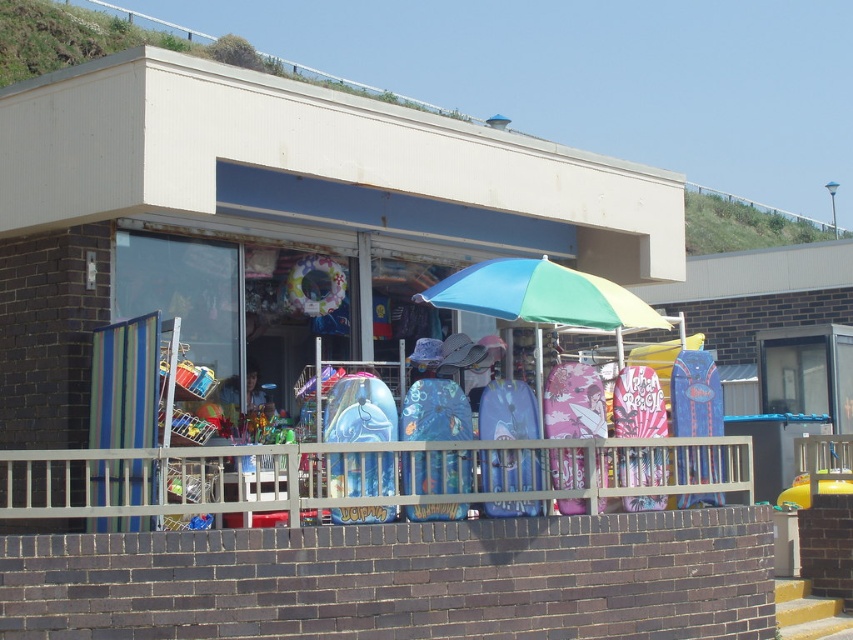
Question: Is metallic silver rail at center to the left of blue-green striped umbrella at center from the viewer's perspective?

Choices:
 (A) no
 (B) yes

Answer: (B)

Question: Which of the following is the closest to the observer?

Choices:
 (A) (370, 512)
 (B) (186, 310)

Answer: (A)

Question: Which of the following is the farthest from the observer?

Choices:
 (A) blue-green striped umbrella at center
 (B) blue glossy surfboard at center
 (C) pink paper at center
 (D) metallic silver rail at center

Answer: (C)

Question: Is metallic silver rail at center to the right of pink paper at center from the viewer's perspective?

Choices:
 (A) no
 (B) yes

Answer: (A)

Question: Is metallic silver rail at center to the right of blue glossy surfboard at center from the viewer's perspective?

Choices:
 (A) yes
 (B) no

Answer: (A)

Question: Which point appears farthest from the camera in this image?

Choices:
 (A) (350, 490)
 (B) (601, 307)
 (C) (3, 227)
 (D) (654, 476)

Answer: (C)